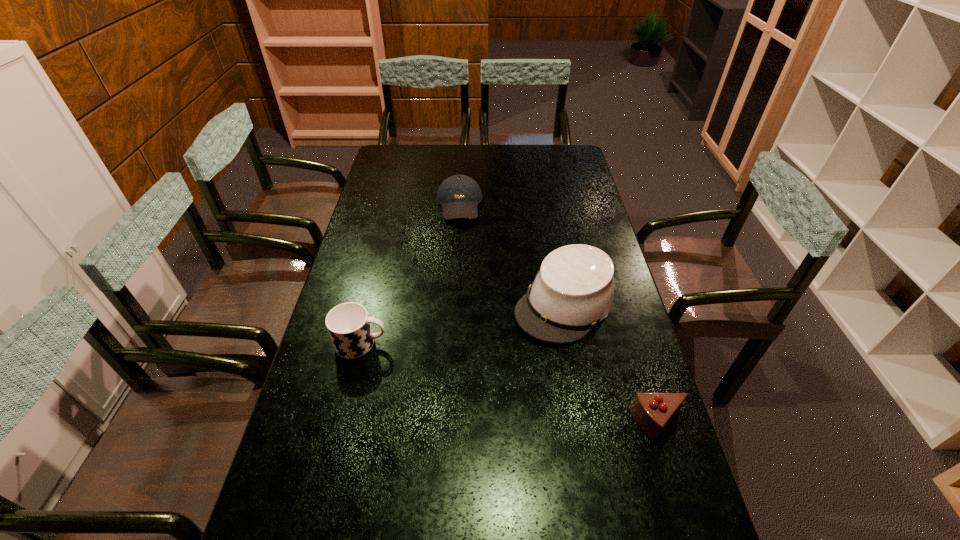
Select which object is the closest to the baseball cap. Please provide its 2D coordinates. Your answer should be formatted as a tuple, i.e. [(x, y)], where the tuple contains the x and y coordinates of a point satisfying the conditions above.

[(573, 291)]